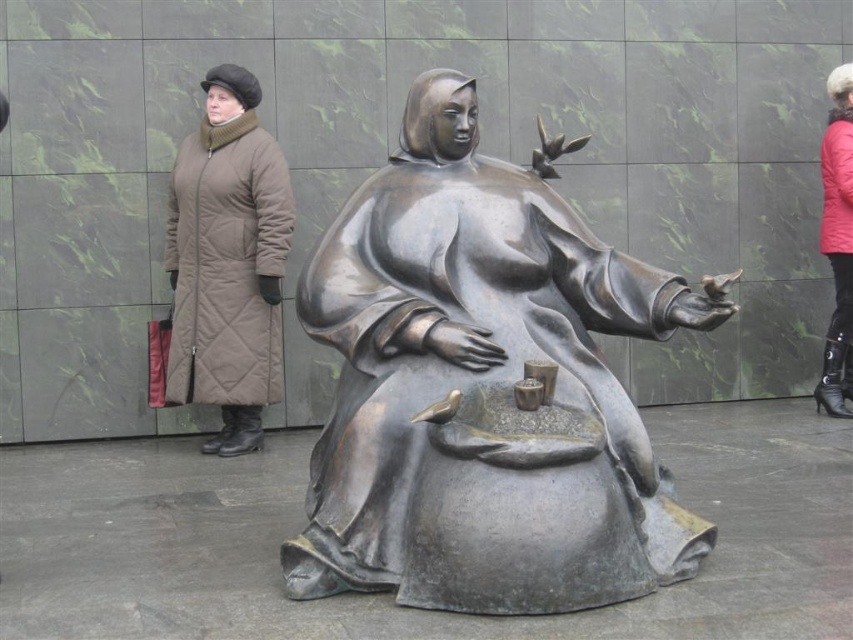
Consider the image. You are a delivery person who needs to place a package between the matte brown coat at left and the red quilted coat at right. The package is 3 meters long. Will it fit between them?

The distance between the matte brown coat at left and red quilted coat at right is 3.54 meters, so the 3 meter long package will fit between them.

You are an art curator planning to display the bronze statue at center and the red quilted coat at right in an exhibition. Given their sizes, which object should be placed on a higher pedestal to ensure both are visible to visitors standing at eye level?

The bronze statue at center is larger than the red quilted coat at right, so placing it on a higher pedestal would ensure both are visible at eye level.

You are standing in front of a sculpture garden and see the bronze statue at center and the red quilted coat at right. Which object is positioned more to the east side of the garden?

The bronze statue at center is positioned more to the east side of the garden since it is to the left of the red quilted coat at right.